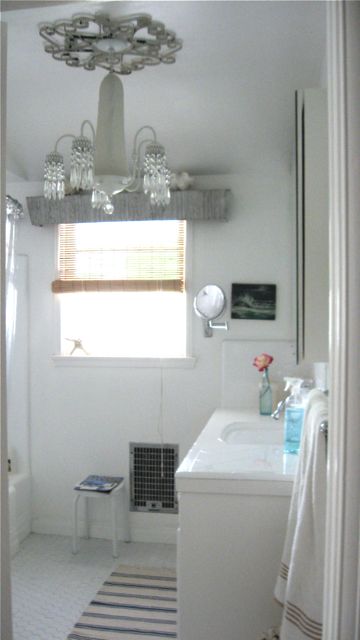
Image resolution: width=360 pixels, height=640 pixels. What are the coordinates of `spray bottle` in the screenshot? It's located at (291, 417).